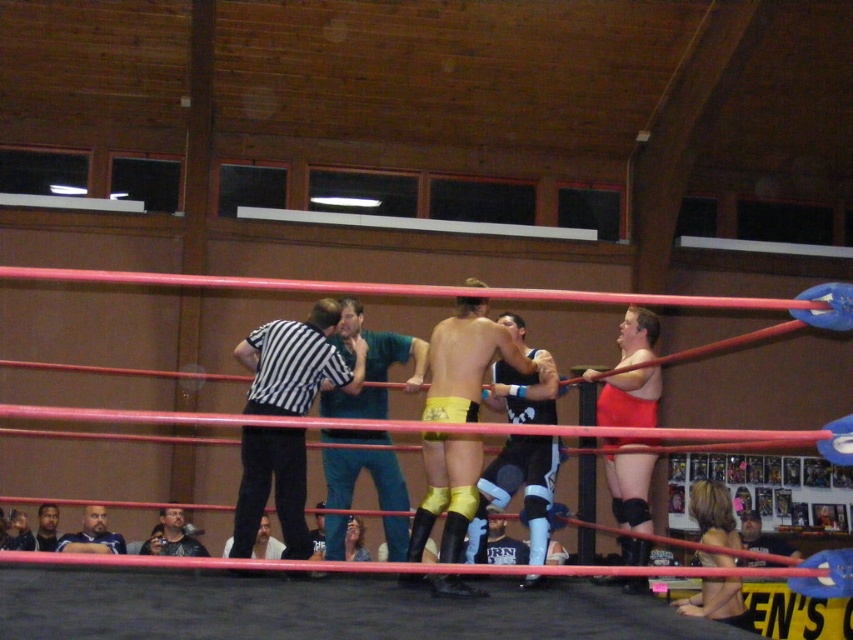
Who is positioned more to the right, teal fabric shirt at center or smooth black shirt at center?

From the viewer's perspective, teal fabric shirt at center appears more on the right side.

Does point (357, 330) lie in front of point (268, 538)?

Yes.

At what (x,y) coordinates should I click in order to perform the action: click on teal fabric shirt at center. Please return your answer as a coordinate pair (x, y). The image size is (853, 640). Looking at the image, I should click on (357, 476).

Can you confirm if black striped shirt at center is bigger than teal fabric shirt at center?

Yes.

How much distance is there between black striped shirt at center and teal fabric shirt at center?

black striped shirt at center is 15.18 inches away from teal fabric shirt at center.

Between point (294, 412) and point (331, 554), which one is positioned in front?

Point (294, 412) is more forward.

At what (x,y) coordinates should I click in order to perform the action: click on black striped shirt at center. Please return your answer as a coordinate pair (x, y). Image resolution: width=853 pixels, height=640 pixels. Looking at the image, I should click on (297, 362).

Does black striped shirt at center have a greater width compared to shiny black shirt at lower left?

Yes.

Does black striped shirt at center appear on the right side of shiny black shirt at lower left?

Indeed, black striped shirt at center is positioned on the right side of shiny black shirt at lower left.

From the picture: Who is more forward, (256, 412) or (148, 541)?

Point (256, 412) is in front.

I want to click on black striped shirt at center, so click(297, 362).